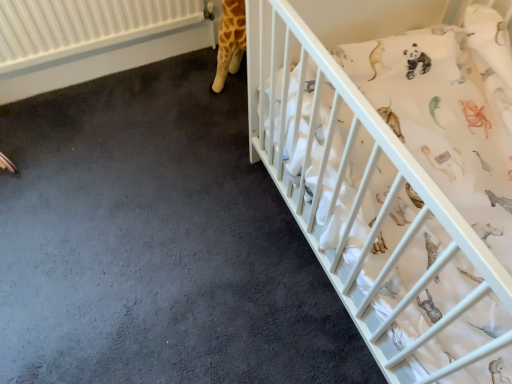
At what (x,y) coordinates should I click in order to perform the action: click on white matte crib at right. Please return your answer as a coordinate pair (x, y). The image size is (512, 384). Looking at the image, I should click on (398, 182).

This screenshot has height=384, width=512. What do you see at coordinates (398, 182) in the screenshot?
I see `white matte crib at right` at bounding box center [398, 182].

Find the location of a particular element. Image resolution: width=512 pixels, height=384 pixels. white matte crib at right is located at coordinates (398, 182).